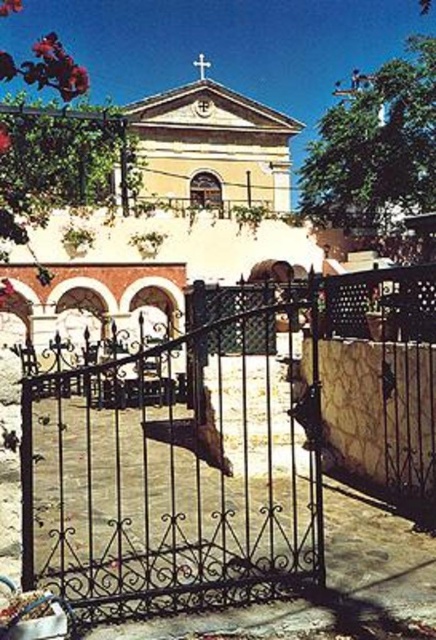
Question: From the image, what is the correct spatial relationship of wrought iron gate at center in relation to white wooden door at center?

Choices:
 (A) right
 (B) left

Answer: (B)

Question: Can you confirm if wrought iron gate at center is wider than white wooden door at center?

Choices:
 (A) yes
 (B) no

Answer: (A)

Question: Which object appears closest to the camera in this image?

Choices:
 (A) white wooden door at center
 (B) wrought iron gate at center

Answer: (B)

Question: Can you confirm if wrought iron gate at center is positioned below white wooden door at center?

Choices:
 (A) yes
 (B) no

Answer: (A)